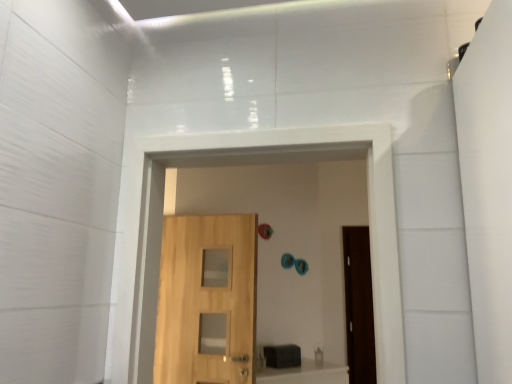
Identify the location of light wood door at center. The image size is (512, 384). (207, 300).

What do you see at coordinates (207, 300) in the screenshot? I see `light wood door at center` at bounding box center [207, 300].

The image size is (512, 384). Describe the element at coordinates (254, 162) in the screenshot. I see `natural wood door at center` at that location.

I want to click on natural wood door at center, so click(x=254, y=162).

In order to click on light wood door at center in this screenshot , I will do `click(207, 300)`.

Between natural wood door at center and light wood door at center, which one appears on the left side from the viewer's perspective?

From the viewer's perspective, light wood door at center appears more on the left side.

Does natural wood door at center lie in front of light wood door at center?

Yes, natural wood door at center is in front of light wood door at center.

Which point is more forward, (217,161) or (248,246)?

The point (217,161) is closer to the camera.

From the image's perspective, is natural wood door at center above or below light wood door at center?

Clearly, from the image's perspective, natural wood door at center is above light wood door at center.

From a real-world perspective, between natural wood door at center and light wood door at center, who is vertically lower?

light wood door at center is physically lower.

Is natural wood door at center wider than light wood door at center?

Yes.

From the picture: Which of these two, natural wood door at center or light wood door at center, stands taller?

light wood door at center.

In the scene shown: Does natural wood door at center have a smaller size compared to light wood door at center?

Actually, natural wood door at center might be larger than light wood door at center.

Is natural wood door at center surrounding light wood door at center?

No.

Does natural wood door at center touch light wood door at center?

No, natural wood door at center is not touching light wood door at center.

Could you tell me if natural wood door at center is turned towards light wood door at center?

No, natural wood door at center does not turn towards light wood door at center.

How much distance is there between natural wood door at center and light wood door at center?

They are 4.19 feet apart.

Find the location of a particular element. passage lying on the right of light wood door at center is located at coordinates (254, 162).

Which object is positioned more to the right, light wood door at center or natural wood door at center?

Positioned to the right is natural wood door at center.

In the image, is light wood door at center positioned in front of or behind natural wood door at center?

Clearly, light wood door at center is behind natural wood door at center.

Is point (205, 292) closer to camera compared to point (154, 193)?

No, (205, 292) is behind (154, 193).

From the image's perspective, does light wood door at center appear lower than natural wood door at center?

Yes, from the image's perspective, light wood door at center is below natural wood door at center.

From a real-world perspective, does light wood door at center stand above natural wood door at center?

Incorrect, from a real-world perspective, light wood door at center is lower than natural wood door at center.

Which object is thinner, light wood door at center or natural wood door at center?

With smaller width is light wood door at center.

Which of these two, light wood door at center or natural wood door at center, stands shorter?

natural wood door at center is shorter.

Does light wood door at center have a smaller size compared to natural wood door at center?

Yes, light wood door at center is smaller than natural wood door at center.

Is natural wood door at center located within light wood door at center?

Actually, natural wood door at center is outside light wood door at center.

Is light wood door at center far away from natural wood door at center?

That's right, there is a large distance between light wood door at center and natural wood door at center.

Is light wood door at center oriented towards natural wood door at center?

Yes, light wood door at center faces towards natural wood door at center.

How many degrees apart are the facing directions of light wood door at center and natural wood door at center?

light wood door at center and natural wood door at center are facing 5.21 degrees away from each other.

You are a GUI agent. You are given a task and a screenshot of the screen. Output one action in this format:
    pyautogui.click(x=<x>, y=<y>)
    Task: Click on the passage above the light wood door at center (from a real-world perspective)
    
    Given the screenshot: What is the action you would take?
    pyautogui.click(x=254, y=162)

In the image, there is a natural wood door at center. Where is `door below it (from the image's perspective)`? door below it (from the image's perspective) is located at coordinates (207, 300).

This screenshot has width=512, height=384. There is a light wood door at center. In order to click on passage above it (from a real-world perspective) in this screenshot , I will do `click(254, 162)`.